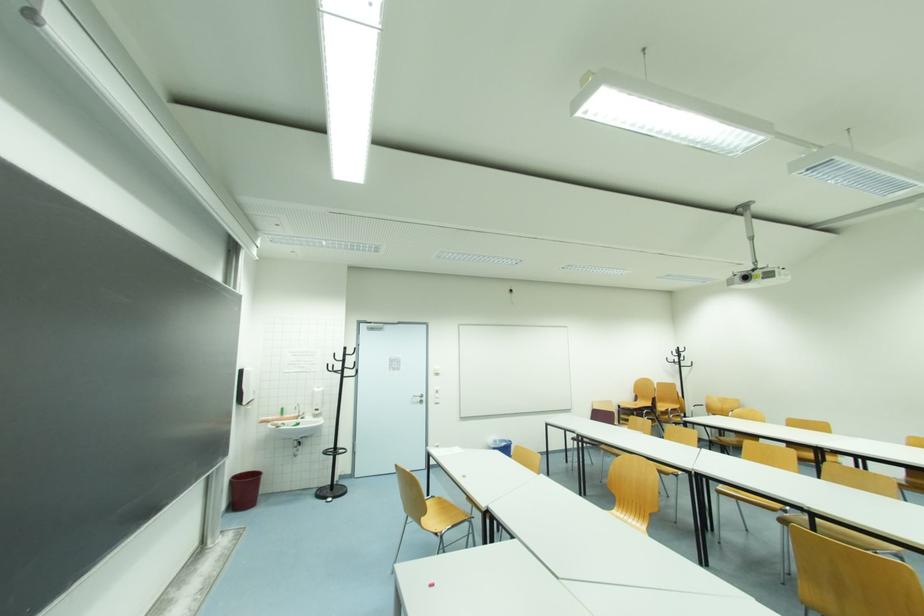
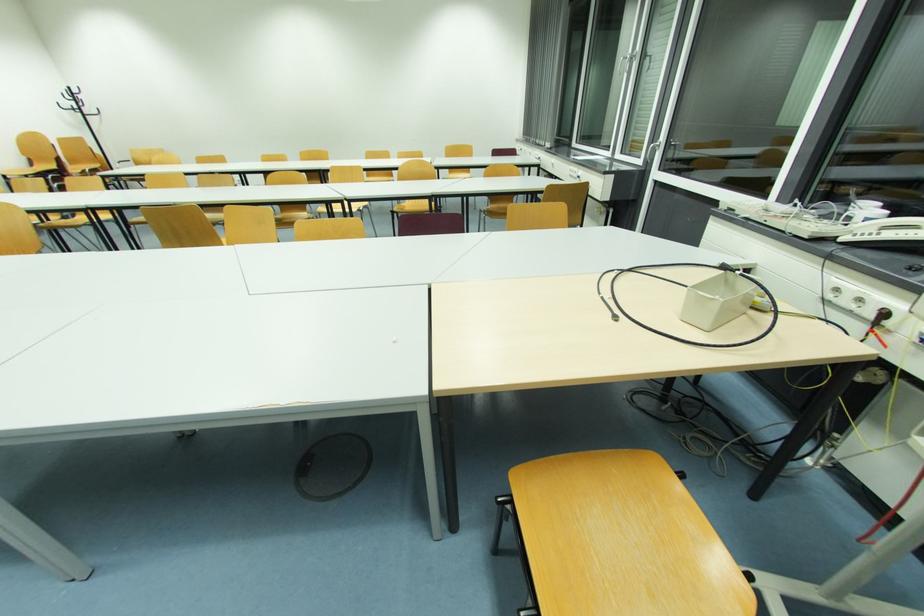
How did the camera likely rotate?

The camera rotated toward right-down.